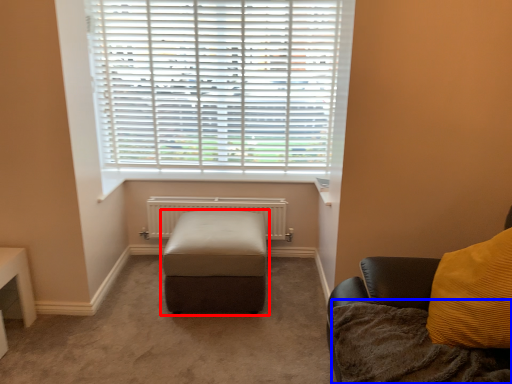
Question: Which object is closer to the camera taking this photo, furniture (highlighted by a red box) or blanket (highlighted by a blue box)?

Choices:
 (A) furniture
 (B) blanket

Answer: (B)